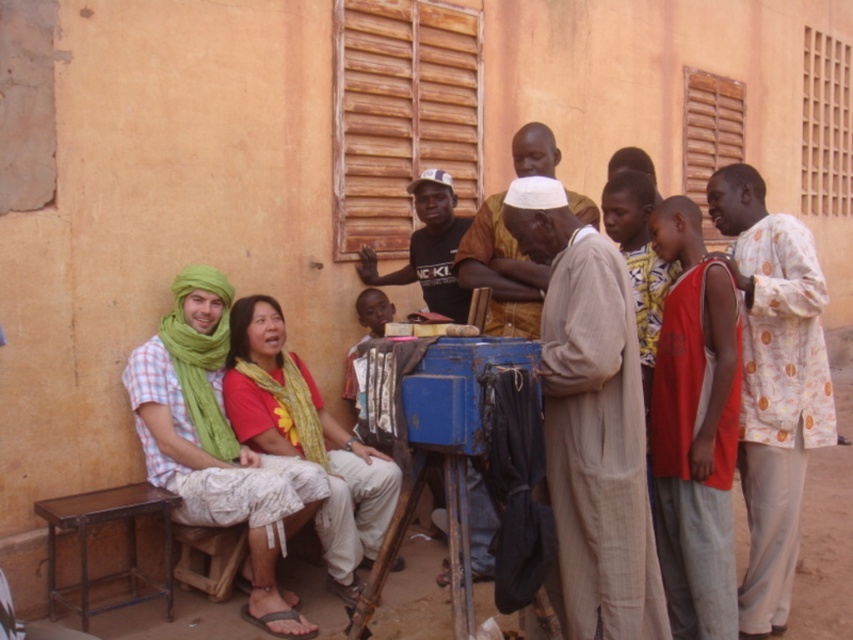
Is light beige fabric at center closer to camera compared to rustic wood stool at lower left?

Yes, it is in front of rustic wood stool at lower left.

Between point (509, 186) and point (134, 540), which one is positioned in front?

Point (509, 186) is more forward.

Is point (558, 337) farther from camera compared to point (62, 509)?

That is False.

Where is `light beige fabric at center`? The width and height of the screenshot is (853, 640). light beige fabric at center is located at coordinates (590, 422).

Which is behind, point (83, 573) or point (196, 586)?

The point (196, 586) is behind.

Is point (161, 593) positioned in front of point (215, 531)?

Yes, it is in front of point (215, 531).

Locate an element on the screen. rustic wood stool at lower left is located at coordinates (126, 541).

You are a GUI agent. You are given a task and a screenshot of the screen. Output one action in this format:
    pyautogui.click(x=<x>, y=<y>)
    Task: Click on the rustic wood stool at lower left
    The height and width of the screenshot is (640, 853).
    Given the screenshot: What is the action you would take?
    pyautogui.click(x=126, y=541)

Does light green fabric turban at left have a lesser width compared to rustic wood stool at lower left?

No, light green fabric turban at left is not thinner than rustic wood stool at lower left.

Who is positioned more to the right, light green fabric turban at left or rustic wood stool at lower left?

light green fabric turban at left is more to the right.

The image size is (853, 640). Identify the location of light green fabric turban at left. (218, 445).

I want to click on light green fabric turban at left, so click(x=218, y=445).